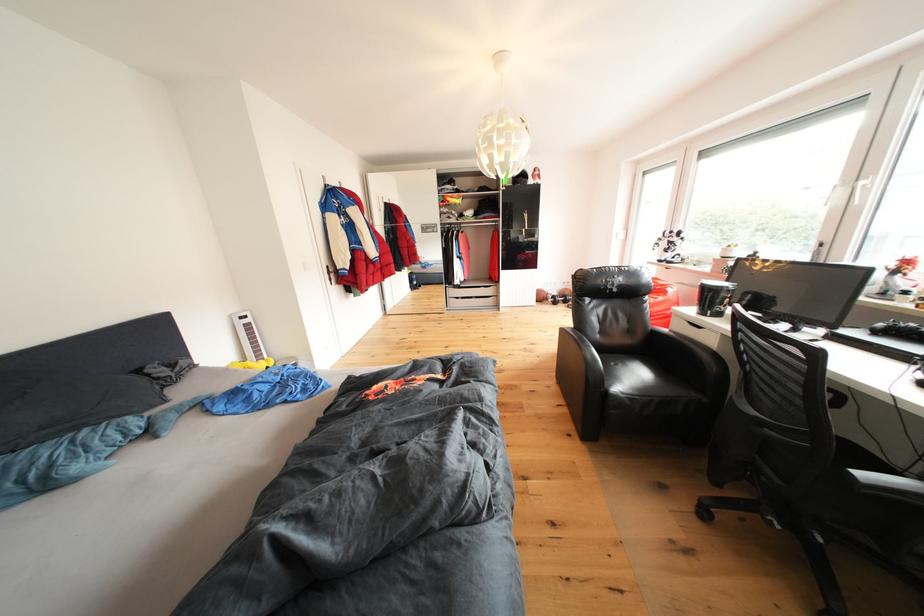
This screenshot has width=924, height=616. What do you see at coordinates (584, 352) in the screenshot? I see `a black leather chair armrest` at bounding box center [584, 352].